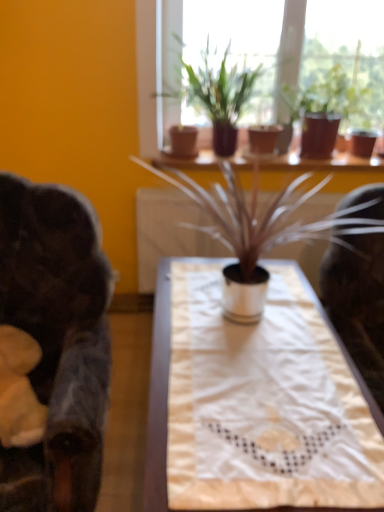
Question: Would you say white fabric table at center is outside matte brown pot at upper center, positioned as the second houseplant in back-to-front order?

Choices:
 (A) no
 (B) yes

Answer: (B)

Question: Does white fabric table at center lie in front of matte brown pot at upper center, positioned as the second houseplant in back-to-front order?

Choices:
 (A) yes
 (B) no

Answer: (A)

Question: Can you confirm if white fabric table at center is wider than matte brown pot at upper center, positioned as the second houseplant in back-to-front order?

Choices:
 (A) yes
 (B) no

Answer: (A)

Question: Is white fabric table at center at the left side of matte brown pot at upper center, positioned as the second houseplant in back-to-front order?

Choices:
 (A) yes
 (B) no

Answer: (A)

Question: Is white fabric table at center bigger than matte brown pot at upper center, which is the 2th houseplant from front to back?

Choices:
 (A) yes
 (B) no

Answer: (A)

Question: Would you say white fabric table at center is a long distance from matte brown pot at upper center, positioned as the second houseplant in back-to-front order?

Choices:
 (A) no
 (B) yes

Answer: (B)

Question: Can you confirm if white metallic pot at center, the third houseplant from the back, is shorter than matte brown pot at upper center, positioned as the second houseplant in back-to-front order?

Choices:
 (A) yes
 (B) no

Answer: (A)

Question: Could you tell me if white metallic pot at center, which appears as the 1th houseplant when viewed from the front, is facing matte brown pot at upper center, positioned as the second houseplant in back-to-front order?

Choices:
 (A) no
 (B) yes

Answer: (A)

Question: From a real-world perspective, is white metallic pot at center, the third houseplant from the back, under matte brown pot at upper center, positioned as the second houseplant in back-to-front order?

Choices:
 (A) no
 (B) yes

Answer: (B)

Question: Is white metallic pot at center, the third houseplant from the back, to the left of matte brown pot at upper center, which is the 2th houseplant from front to back, from the viewer's perspective?

Choices:
 (A) yes
 (B) no

Answer: (A)

Question: Is white metallic pot at center, which appears as the 1th houseplant when viewed from the front, completely or partially outside of matte brown pot at upper center, which is the 2th houseplant from front to back?

Choices:
 (A) yes
 (B) no

Answer: (A)

Question: Can you confirm if white metallic pot at center, which appears as the 1th houseplant when viewed from the front, is wider than matte brown pot at upper center, which is the 2th houseplant from front to back?

Choices:
 (A) no
 (B) yes

Answer: (B)

Question: Is matte brown pot at upper center, which is the 3th houseplant in front-to-back order, located within white metallic pot at center, the third houseplant from the back?

Choices:
 (A) no
 (B) yes

Answer: (A)